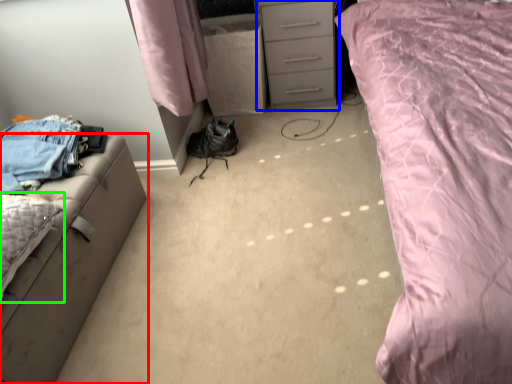
Question: Which object is positioned closest to furniture (highlighted by a red box)? Select from chest of drawers (highlighted by a blue box) and pillow (highlighted by a green box).

Choices:
 (A) chest of drawers
 (B) pillow

Answer: (B)